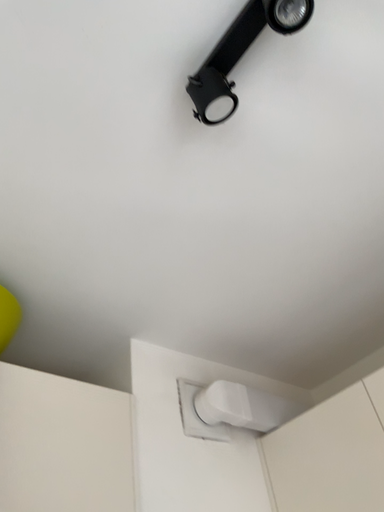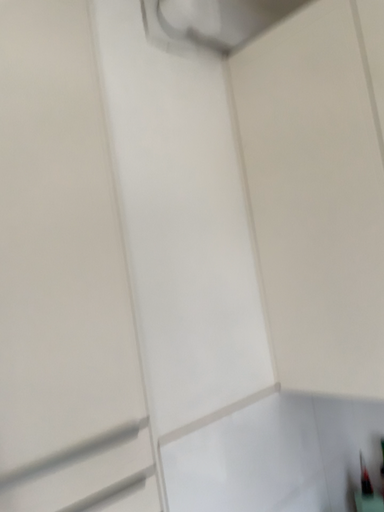
Question: How did the camera likely rotate when shooting the video?

Choices:
 (A) rotated downward
 (B) rotated upward

Answer: (A)